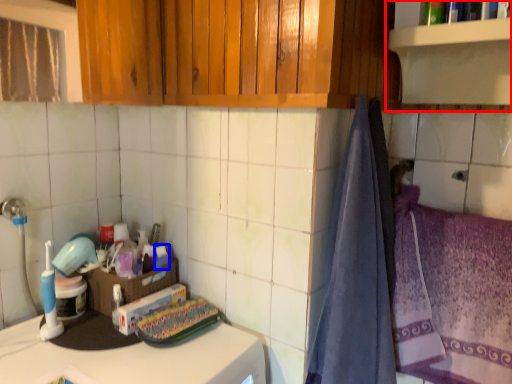
Question: Which of the following is the farthest to the observer, shelf (highlighted by a red box) or toiletry (highlighted by a blue box)?

Choices:
 (A) shelf
 (B) toiletry

Answer: (B)